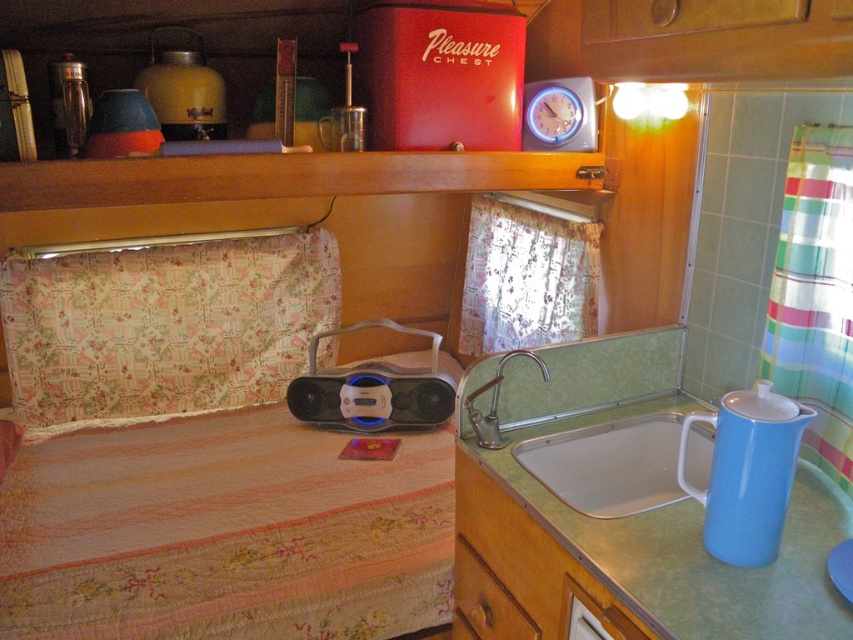
You are a delivery robot with a package that needs to be placed on the green laminate countertop at lower right. You are currently positioned at the camera location. Can you reach the countertop without moving your position? Please explain your reasoning.

A: The green laminate countertop at lower right and camera are 37.30 inches apart. Since the robot can extend its arm or appendage to reach 37.30 inches, it can place the package on the countertop without moving from the camera location.

You are standing in the kitchen and want to reach both the multicolored striped fabric at right and the brushed metal faucet at sink center. Which object would you need to move closer to first?

You would need to move closer to the multicolored striped fabric at right first since it is closer to the viewer than the brushed metal faucet at sink center.